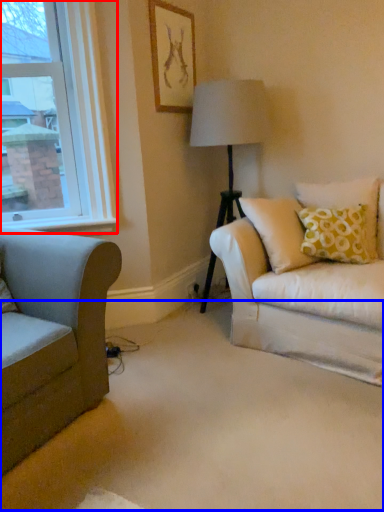
Question: Among these objects, which one is nearest to the camera, window (highlighted by a red box) or plain (highlighted by a blue box)?

Choices:
 (A) window
 (B) plain

Answer: (B)